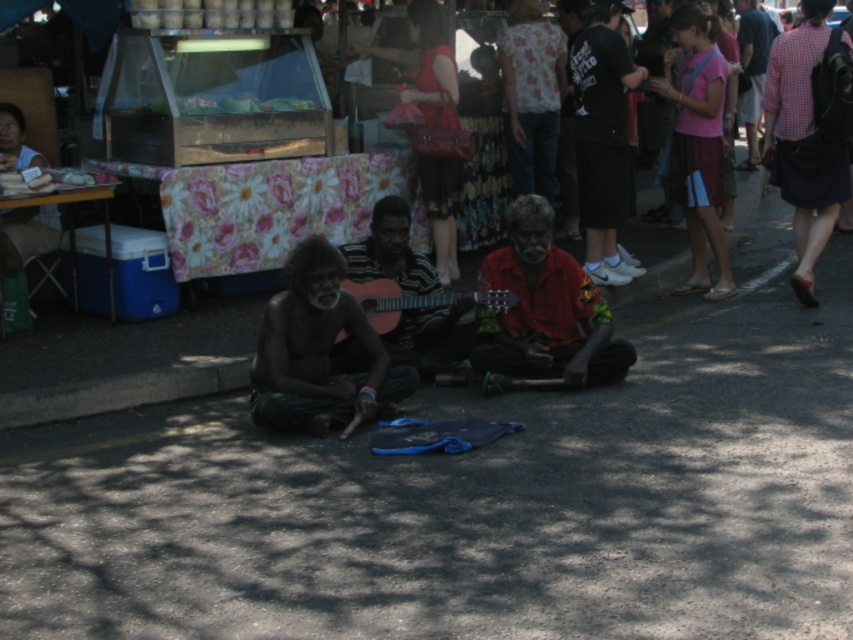
Question: Among these objects, which one is nearest to the camera?

Choices:
 (A) pink fabric skirt at right
 (B) pink cotton shirt at upper right

Answer: (A)

Question: Is matte black man at center smaller than wooden guitar at center?

Choices:
 (A) no
 (B) yes

Answer: (A)

Question: Which object appears farthest from the camera in this image?

Choices:
 (A) matte black man at center
 (B) wooden guitar at center

Answer: (A)

Question: Can you confirm if pink fabric skirt at right is wider than pink cotton shirt at upper right?

Choices:
 (A) yes
 (B) no

Answer: (B)

Question: Is matte black man at center to the right of pink fabric skirt at right from the viewer's perspective?

Choices:
 (A) yes
 (B) no

Answer: (A)

Question: Which object is farther from the camera taking this photo?

Choices:
 (A) shiny black guitar at center
 (B) matte black man at center

Answer: (B)